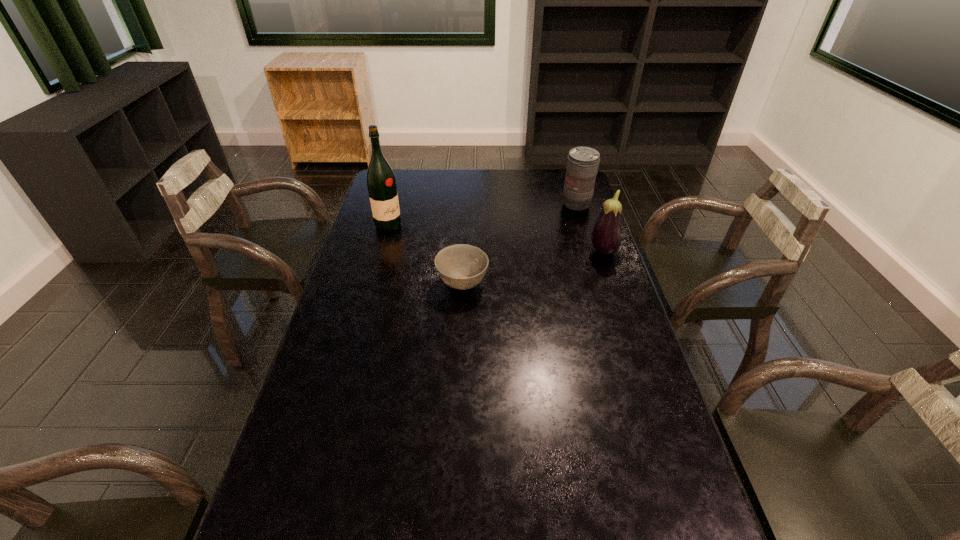
Identify the location of the second object from left to right. (461, 266).

At what (x,y) coordinates should I click in order to perform the action: click on the nearest object. Please return your answer as a coordinate pair (x, y). The image size is (960, 540). Looking at the image, I should click on (461, 266).

The image size is (960, 540). I want to click on the third farthest object, so click(606, 237).

Locate an element on the screen. the farthest object is located at coordinates point(582,165).

Locate an element on the screen. the third nearest object is located at coordinates (381, 182).

At what (x,y) coordinates should I click in order to perform the action: click on the tallest object. Please return your answer as a coordinate pair (x, y). The width and height of the screenshot is (960, 540). Looking at the image, I should click on (381, 182).

Image resolution: width=960 pixels, height=540 pixels. I want to click on free space located on the front of the second object from left to right, so click(461, 328).

Locate an element on the screen. Image resolution: width=960 pixels, height=540 pixels. free space located on the left of the eggplant is located at coordinates (526, 252).

At what (x,y) coordinates should I click in order to perform the action: click on vacant area situated on the side of the telephoto lens where the control switches are located. Please return your answer as a coordinate pair (x, y). This screenshot has height=540, width=960. Looking at the image, I should click on (536, 261).

At what (x,y) coordinates should I click in order to perform the action: click on vacant space located on the side of the telephoto lens where the control switches are located. Please return your answer as a coordinate pair (x, y). This screenshot has height=540, width=960. Looking at the image, I should click on (543, 250).